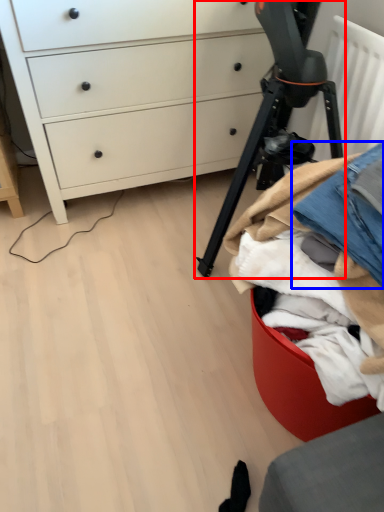
Question: Among these objects, which one is nearest to the camera, tripod (highlighted by a red box) or jeans (highlighted by a blue box)?

Choices:
 (A) tripod
 (B) jeans

Answer: (B)